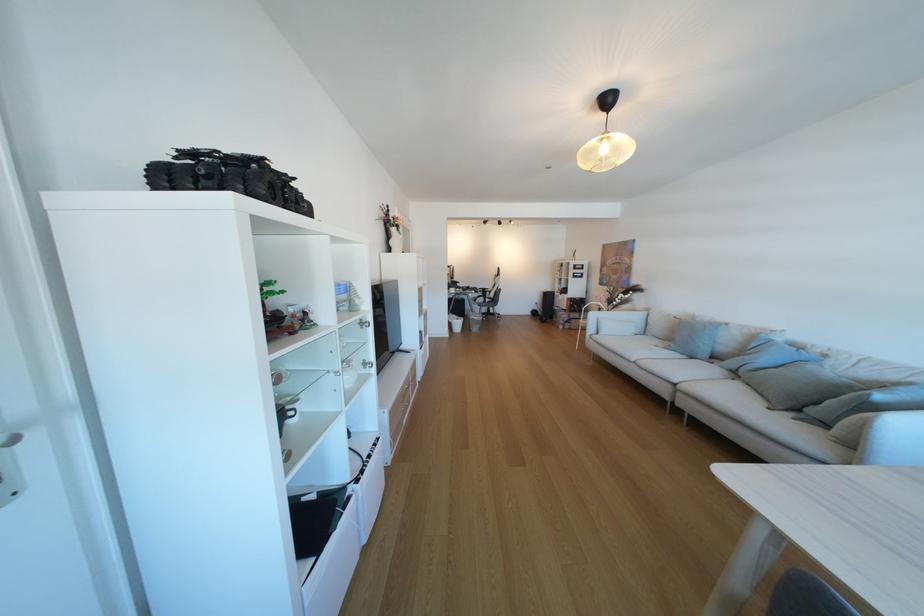
The height and width of the screenshot is (616, 924). Describe the element at coordinates (615, 322) in the screenshot. I see `the sofa armrest` at that location.